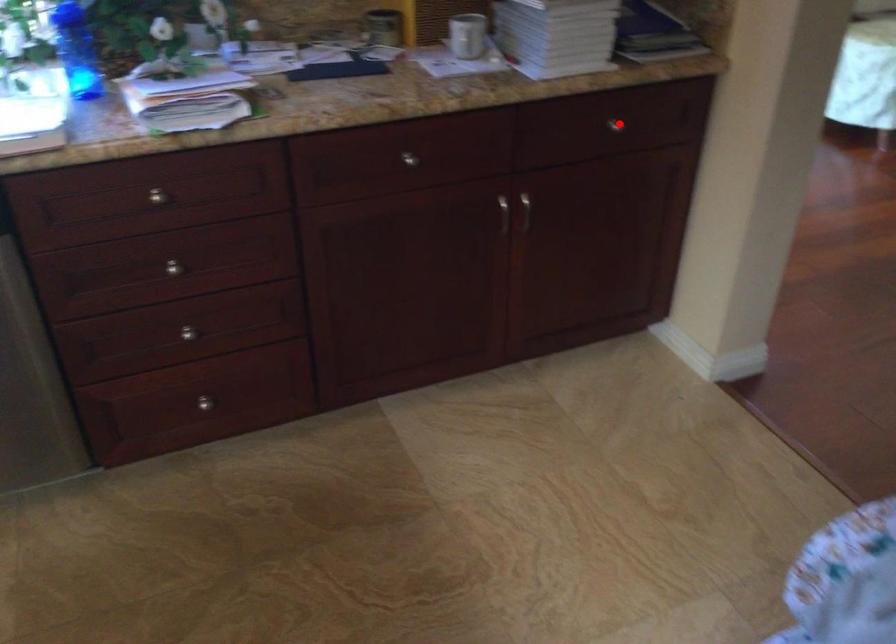
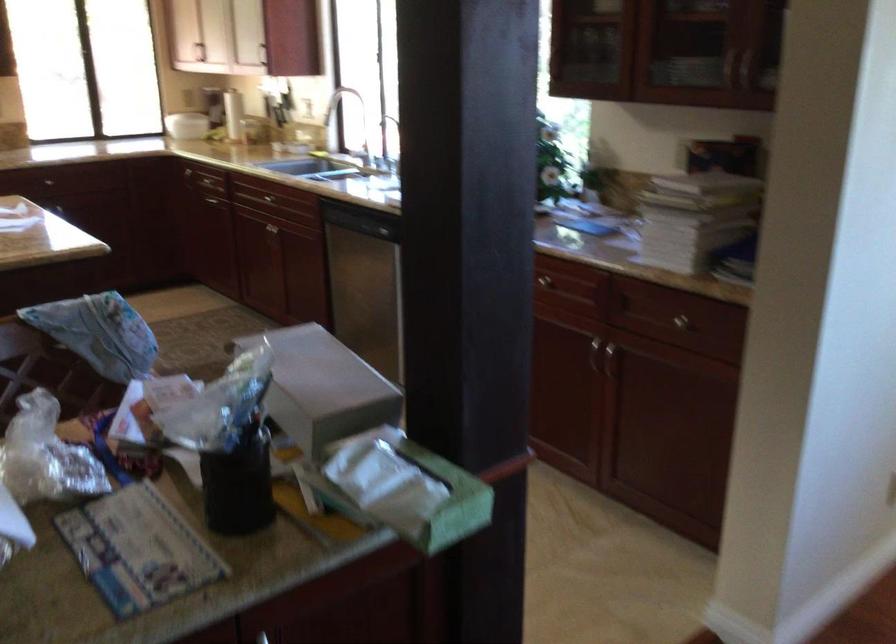
The point at the highlighted location is marked in the first image. Where is the corresponding point in the second image?

(682, 323)